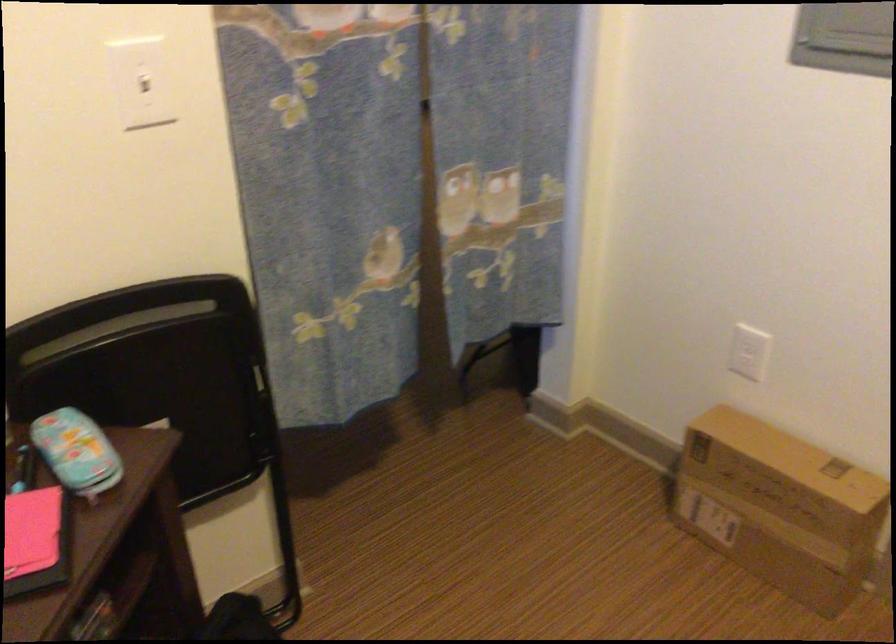
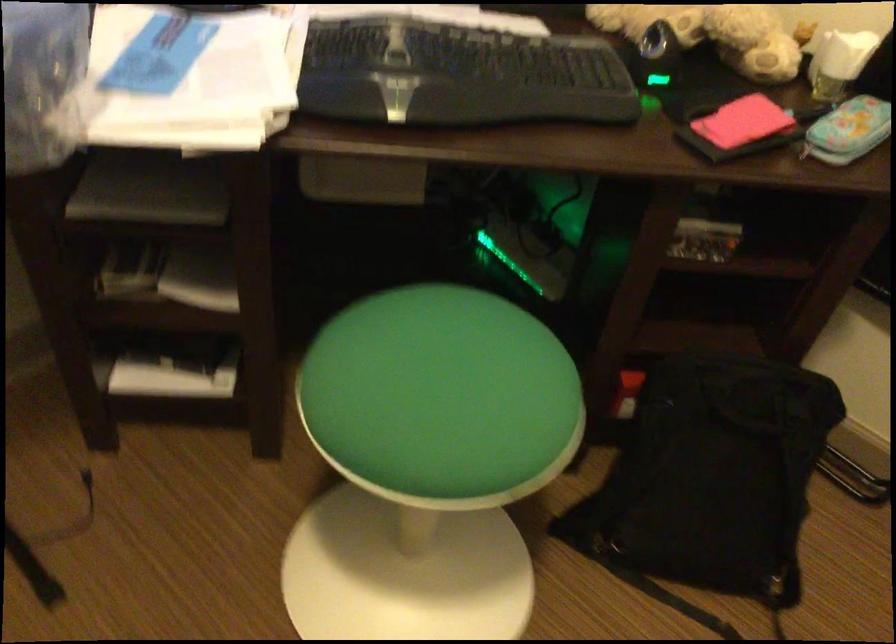
Where in the second image is the point corresponding to (112,444) from the first image?

(848, 129)